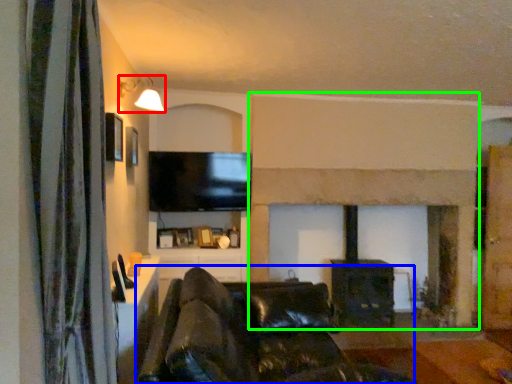
Question: Estimate the real-world distances between objects in this image. Which object is closer to light fixture (highlighted by a red box), studio couch (highlighted by a blue box) or fireplace (highlighted by a green box)?

Choices:
 (A) studio couch
 (B) fireplace

Answer: (A)